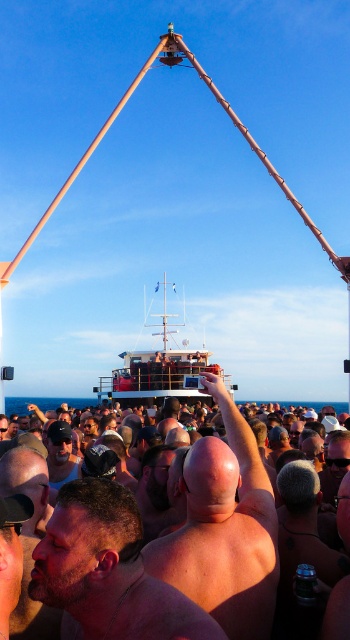
Based on the photo, which is more to the left, beige skin at center or wooden ship at center?

From the viewer's perspective, wooden ship at center appears more on the left side.

Can you confirm if beige skin at center is positioned above wooden ship at center?

No, beige skin at center is not above wooden ship at center.

The width and height of the screenshot is (350, 640). Find the location of `beige skin at center`. beige skin at center is located at coordinates (x=225, y=529).

I want to click on beige skin at center, so click(225, 529).

Which is more to the left, bald head at center or dark brown skin at center?

dark brown skin at center is more to the left.

Is point (262, 476) closer to viewer compared to point (136, 612)?

No, (262, 476) is behind (136, 612).

Does point (263, 515) lie in front of point (95, 570)?

No, (263, 515) is further to viewer.

Where is `bald head at center`? bald head at center is located at coordinates (224, 529).

In the scene shown: Which of these two, bald head at center or wooden ship at center, stands shorter?

With less height is bald head at center.

Is point (253, 497) closer to viewer compared to point (156, 385)?

Yes, it is in front of point (156, 385).

Between point (276, 544) and point (158, 392), which one is positioned behind?

The point (158, 392) is behind.

I want to click on bald head at center, so click(x=224, y=529).